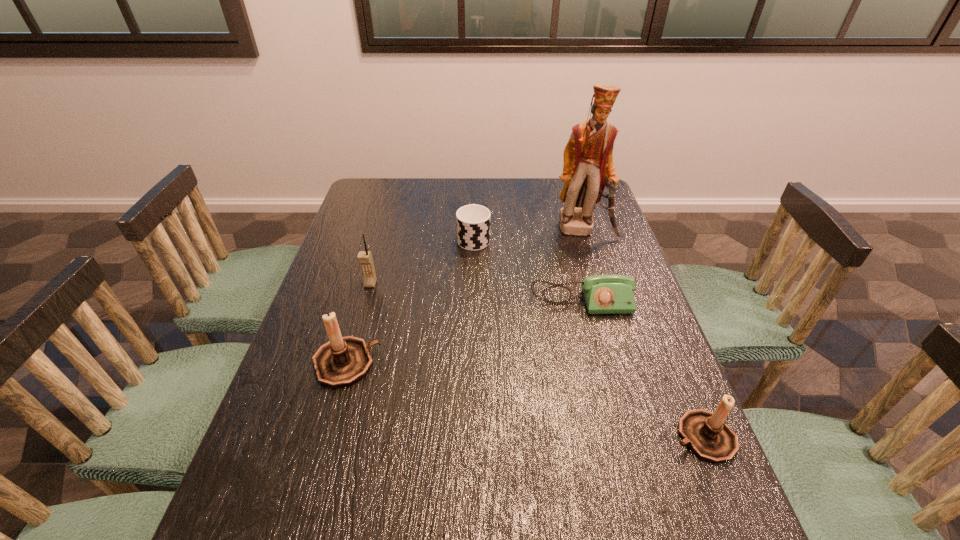
If equal spacing is desired by inserting an extra candle_holder among them, please point out a free spot for this new candle_holder. Please provide its 2D coordinates. Your answer should be formatted as a tuple, i.e. [(x, y)], where the tuple contains the x and y coordinates of a point satisfying the conditions above.

[(512, 397)]